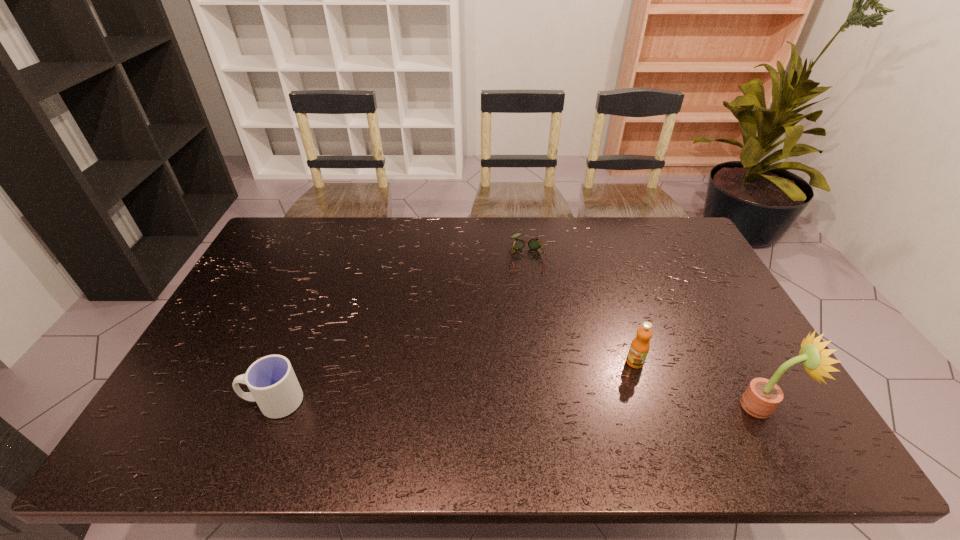
This screenshot has height=540, width=960. What are the coordinates of `the leftmost object` in the screenshot? It's located at (273, 385).

Find the location of a particular element. The width and height of the screenshot is (960, 540). cup is located at coordinates (273, 385).

This screenshot has height=540, width=960. Find the location of `sunflower`. sunflower is located at coordinates (762, 396).

I want to click on the rightmost object, so click(762, 396).

I want to click on spectacles, so click(535, 244).

The height and width of the screenshot is (540, 960). Find the location of `the farthest object`. the farthest object is located at coordinates (535, 244).

At what (x,y) coordinates should I click in order to perform the action: click on the second object from right to left. Please return your answer as a coordinate pair (x, y). The width and height of the screenshot is (960, 540). Looking at the image, I should click on (640, 346).

Identify the location of orange juice. (640, 346).

Identify the location of free region located with the handle on the side of the cup. The image size is (960, 540). (224, 401).

You are a GUI agent. You are given a task and a screenshot of the screen. Output one action in this format:
    pyautogui.click(x=<x>, y=<y>)
    Task: Click on the free spot located with the handle on the side of the cup
    
    Given the screenshot: What is the action you would take?
    pyautogui.click(x=211, y=401)